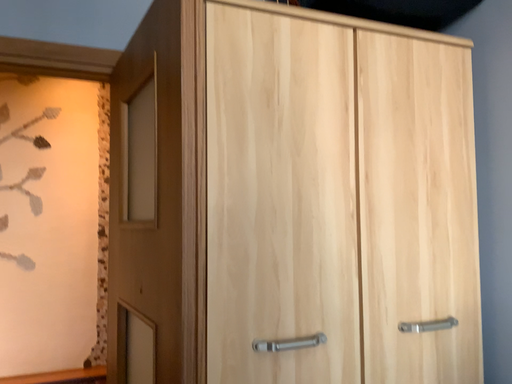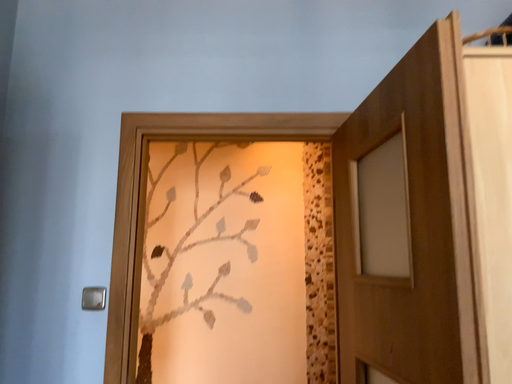
Question: Which way did the camera rotate in the video?

Choices:
 (A) rotated right
 (B) rotated left

Answer: (B)